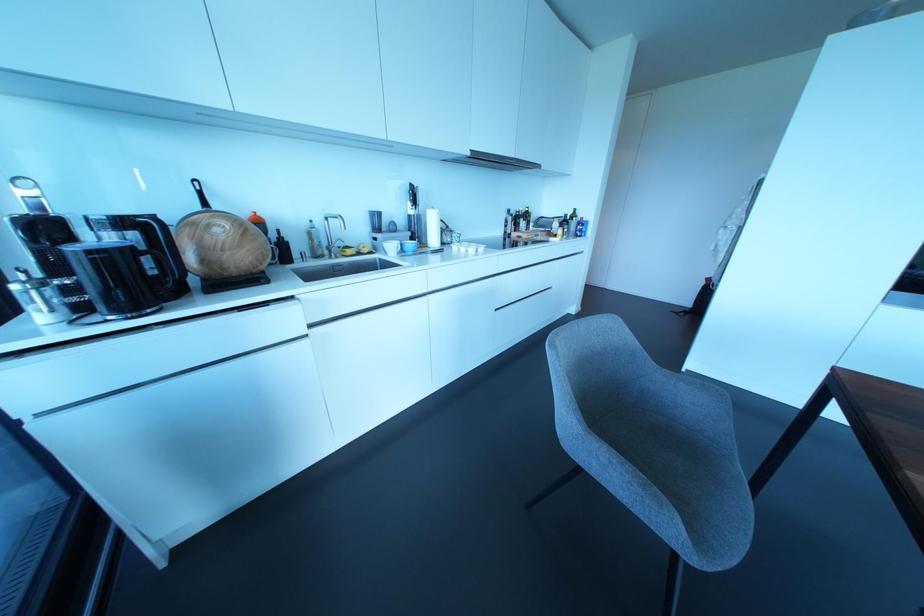
What are the coordinates of `grey chair sitting surface` in the screenshot? It's located at (696, 469).